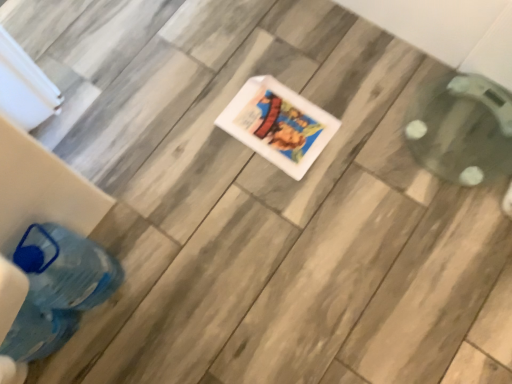
This screenshot has width=512, height=384. What are the coordinates of `vacant space behind blue plastic bottle at lower left` in the screenshot? It's located at (125, 213).